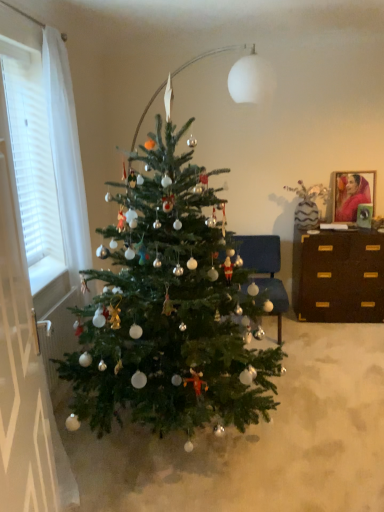
Question: In terms of width, does matte red fabric portrait at upper right look wider or thinner when compared to blue fabric chair at center?

Choices:
 (A) thin
 (B) wide

Answer: (A)

Question: From a real-world perspective, is matte red fabric portrait at upper right positioned above or below blue fabric chair at center?

Choices:
 (A) below
 (B) above

Answer: (B)

Question: Which object is the closest to the brown wood desk at right?

Choices:
 (A) matte red fabric portrait at upper right
 (B) blue fabric chair at center
 (C) white textured curtain at left
 (D) green matte christmas tree at center

Answer: (B)

Question: Estimate the real-world distances between objects in this image. Which object is farther from the blue fabric chair at center?

Choices:
 (A) matte red fabric portrait at upper right
 (B) brown wood desk at right
 (C) green matte christmas tree at center
 (D) white textured curtain at left

Answer: (D)